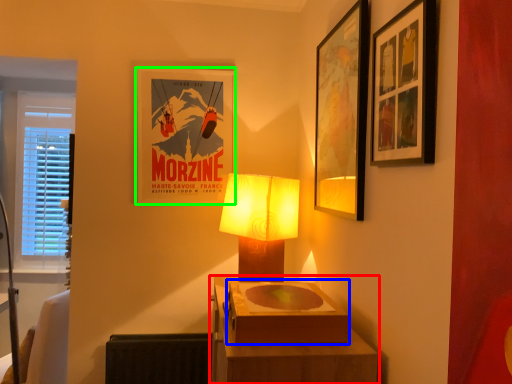
Question: Which object is the farthest from table (highlighted by a red box)? Choose among these: box (highlighted by a blue box) or picture frame (highlighted by a green box).

Choices:
 (A) box
 (B) picture frame

Answer: (B)